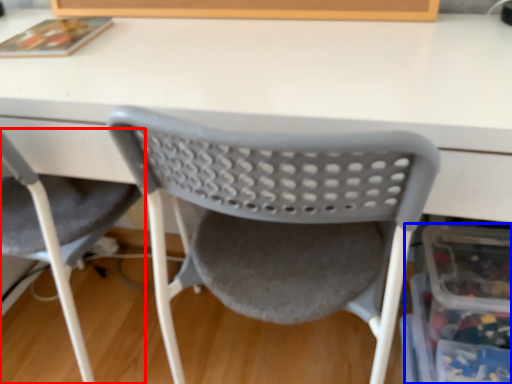
Question: Among these objects, which one is farthest to the camera, chair (highlighted by a red box) or storage box (highlighted by a blue box)?

Choices:
 (A) chair
 (B) storage box

Answer: (B)